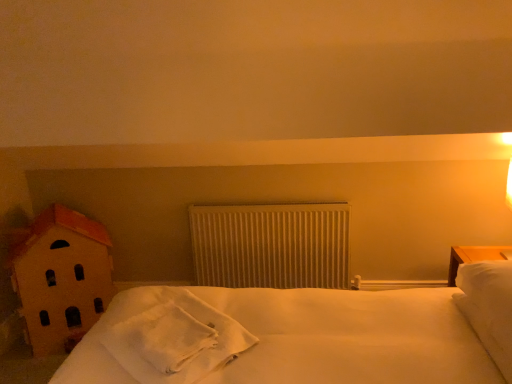
Question: In terms of width, does white soft towel at center look wider or thinner when compared to wooden house at left?

Choices:
 (A) thin
 (B) wide

Answer: (B)

Question: Choose the correct answer: Is white soft towel at center inside wooden house at left or outside it?

Choices:
 (A) outside
 (B) inside

Answer: (A)

Question: Considering the real-world distances, which object is farthest from the white soft pillow at right?

Choices:
 (A) white soft towel at center
 (B) white textured radiator at center
 (C) wooden house at left

Answer: (C)

Question: Which object is positioned closest to the white textured radiator at center?

Choices:
 (A) white soft pillow at right
 (B) white soft towel at center
 (C) wooden house at left

Answer: (C)